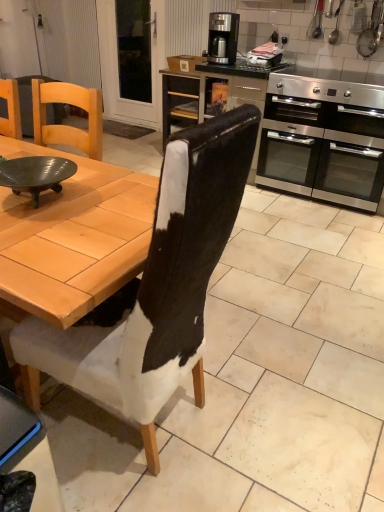
At what (x,y) coordinates should I click in order to perform the action: click on vacant point to the right of matte black bowl at left. Please return your answer as a coordinate pair (x, y). The width and height of the screenshot is (384, 512). Looking at the image, I should click on (107, 203).